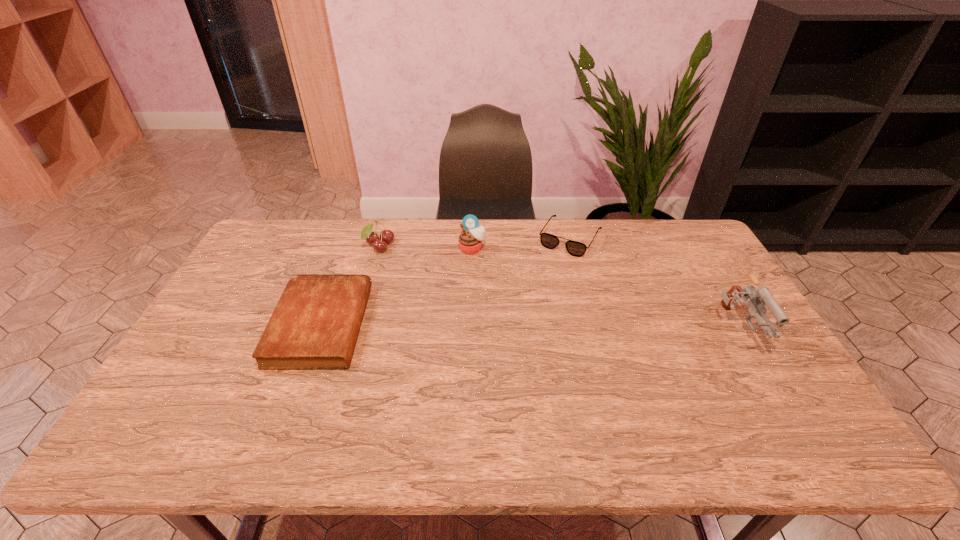
Find the location of a particular element. The width and height of the screenshot is (960, 540). vacant area that lies between the gun and the fourth object from left to right is located at coordinates (652, 284).

Locate an element on the screen. The image size is (960, 540). vacant space in between the muffin and the rightmost object is located at coordinates [603, 289].

Find the location of `vacant area that lies between the muffin and the cherry`. vacant area that lies between the muffin and the cherry is located at coordinates (426, 247).

Where is `vacant region between the muffin and the fourth object from left to right`? This screenshot has height=540, width=960. vacant region between the muffin and the fourth object from left to right is located at coordinates (521, 243).

The image size is (960, 540). Find the location of `free point between the rightmost object and the Bible`. free point between the rightmost object and the Bible is located at coordinates (527, 327).

You are a GUI agent. You are given a task and a screenshot of the screen. Output one action in this format:
    pyautogui.click(x=<x>, y=<y>)
    Task: Click on the free spot between the second object from right to left and the Bible
    The image size is (960, 540).
    Given the screenshot: What is the action you would take?
    pyautogui.click(x=445, y=281)

Image resolution: width=960 pixels, height=540 pixels. Find the location of `object that is the second closest to the fourth object from left to right`. object that is the second closest to the fourth object from left to right is located at coordinates (761, 296).

Point out which object is positioned as the fourth nearest to the rightmost object. Please provide its 2D coordinates. Your answer should be formatted as a tuple, i.e. [(x, y)], where the tuple contains the x and y coordinates of a point satisfying the conditions above.

[(315, 324)]

Where is `vacant space that satisfies the following two spatial constraints: 1. on the front side of the muffin; 2. on the right side of the cherry`? vacant space that satisfies the following two spatial constraints: 1. on the front side of the muffin; 2. on the right side of the cherry is located at coordinates (379, 248).